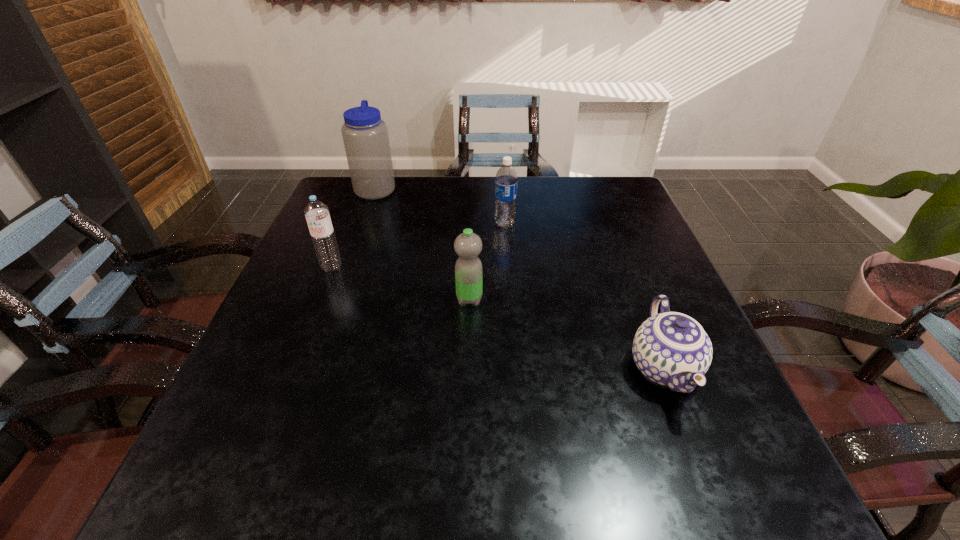
At what (x,y) coordinates should I click in order to perform the action: click on free space between the second object from right to left and the farthest object. Please return your answer as a coordinate pair (x, y). The image size is (960, 540). Looking at the image, I should click on [441, 206].

Locate an element on the screen. free space that is in between the farthest water bottle and the third farthest water bottle is located at coordinates pos(353,227).

Locate which object ranks fourth in proximity to the third nearest object. Please provide its 2D coordinates. Your answer should be formatted as a tuple, i.e. [(x, y)], where the tuple contains the x and y coordinates of a point satisfying the conditions above.

[(672, 349)]

At what (x,y) coordinates should I click in order to perform the action: click on object that is the nearest to the second farthest water bottle. Please return your answer as a coordinate pair (x, y). This screenshot has height=540, width=960. Looking at the image, I should click on (468, 268).

I want to click on the third closest water bottle to the farthest object, so click(x=468, y=268).

Identify which water bottle is located as the nearest to the third farthest water bottle. Please provide its 2D coordinates. Your answer should be formatted as a tuple, i.e. [(x, y)], where the tuple contains the x and y coordinates of a point satisfying the conditions above.

[(365, 136)]

I want to click on vacant space that satisfies the following two spatial constraints: 1. with a carrying loop on the side of the second water bottle from right to left; 2. on the right side of the tallest water bottle, so click(337, 300).

I want to click on vacant space that satisfies the following two spatial constraints: 1. with a carrying loop on the side of the tallest water bottle; 2. on the right side of the third object from right to left, so click(x=337, y=300).

Where is `free point that satisfies the following two spatial constraints: 1. on the back side of the nearest water bottle; 2. with a carrying loop on the side of the tallest object`? free point that satisfies the following two spatial constraints: 1. on the back side of the nearest water bottle; 2. with a carrying loop on the side of the tallest object is located at coordinates (472, 188).